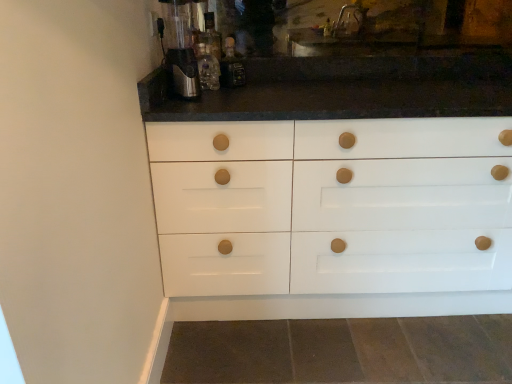
Question: Is satin silver coffee machine at upper left wider or thinner than translucent glass bottle at upper center, the 2th bottle from the right?

Choices:
 (A) thin
 (B) wide

Answer: (B)

Question: From the image's perspective, is satin silver coffee machine at upper left positioned above or below translucent glass bottle at upper center, the 2th bottle from the right?

Choices:
 (A) above
 (B) below

Answer: (A)

Question: Which object is positioned closest to the translucent glass bottle at center, which is counted as the first bottle, starting from the right?

Choices:
 (A) satin silver coffee machine at upper left
 (B) translucent glass bottle at upper center, the 2th bottle from the right

Answer: (B)

Question: Based on their relative distances, which object is nearer to the translucent glass bottle at center, which ranks as the second bottle in left-to-right order?

Choices:
 (A) translucent glass bottle at upper center, the 2th bottle from the right
 (B) satin silver coffee machine at upper left

Answer: (A)